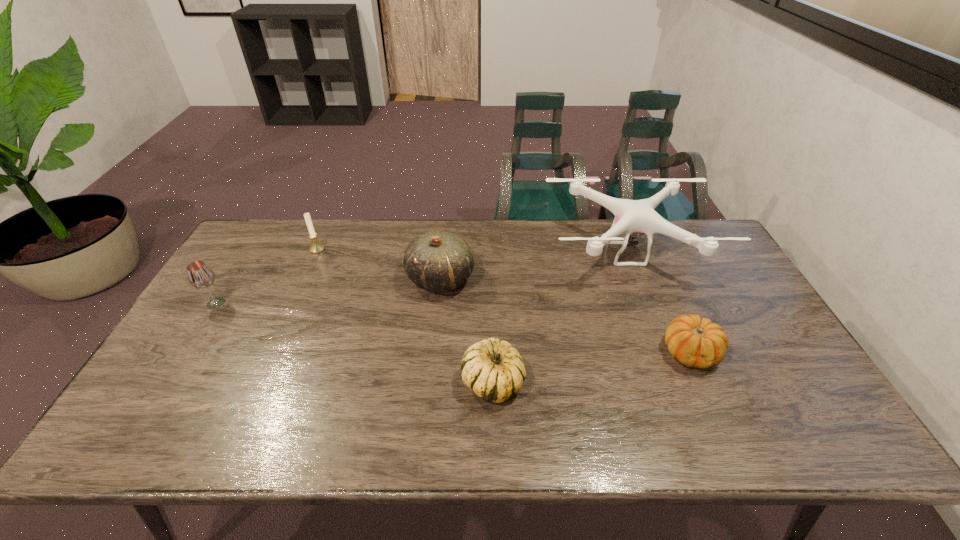
In order to click on free space between the second object from left to right and the shortest object in this screenshot , I will do `click(504, 301)`.

Locate an element on the screen. free point between the second tallest gourd and the wineglass is located at coordinates (354, 342).

Where is `vacant space that's between the farthest gourd and the tallest object`? This screenshot has width=960, height=540. vacant space that's between the farthest gourd and the tallest object is located at coordinates (533, 266).

Point out which object is positioned as the nearest to the leftmost object. Please provide its 2D coordinates. Your answer should be formatted as a tuple, i.e. [(x, y)], where the tuple contains the x and y coordinates of a point satisfying the conditions above.

[(316, 248)]

Identify the location of object that stands as the fifth closest to the wineglass. (696, 342).

This screenshot has height=540, width=960. I want to click on gourd that is the closest to the leftmost object, so [x=439, y=261].

Locate an element on the screen. The image size is (960, 540). the third closest gourd to the leftmost object is located at coordinates (696, 342).

Image resolution: width=960 pixels, height=540 pixels. I want to click on vacant space that satisfies the following two spatial constraints: 1. on the front side of the shortest object; 2. on the left side of the second object from left to right, so click(x=272, y=352).

Identify the location of vacant area in the image that satisfies the following two spatial constraints: 1. on the front side of the leftmost object; 2. on the left side of the second tallest gourd. The width and height of the screenshot is (960, 540). (167, 382).